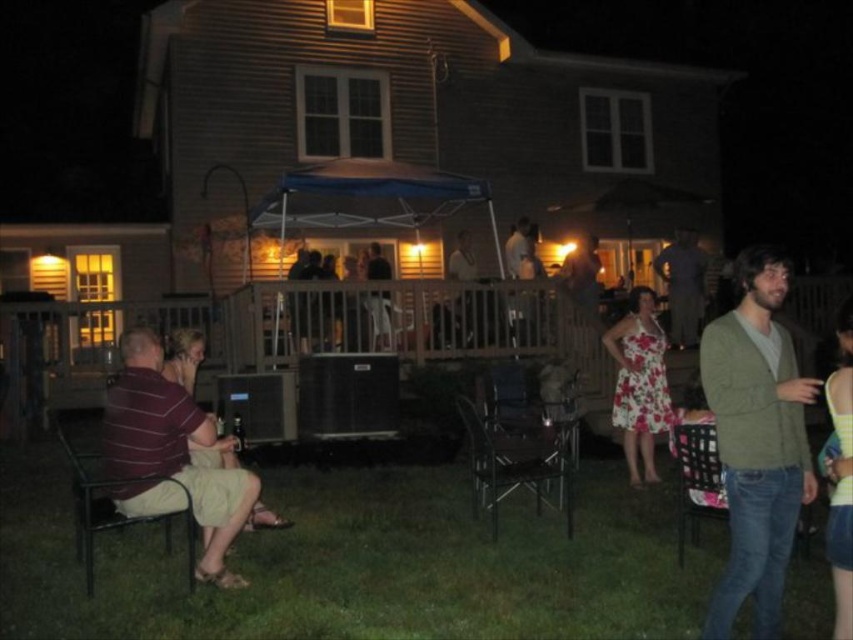
Question: Can you confirm if maroon striped shirt at lower left is positioned below metallic silver chair at center?

Choices:
 (A) yes
 (B) no

Answer: (B)

Question: Can you confirm if wooden deck at center is bigger than dark gray shirt at right?

Choices:
 (A) yes
 (B) no

Answer: (A)

Question: Which of the following is the farthest from the observer?

Choices:
 (A) wooden deck at center
 (B) metallic silver chair at center

Answer: (A)

Question: Among these objects, which one is farthest from the camera?

Choices:
 (A) green sweater at right
 (B) metallic silver chair at center
 (C) metallic black chair at lower left

Answer: (B)

Question: Does wooden deck at center appear on the right side of maroon striped shirt at lower left?

Choices:
 (A) yes
 (B) no

Answer: (A)

Question: Which of the following is the farthest from the observer?

Choices:
 (A) metallic silver chair at lower right
 (B) green sweater at right

Answer: (A)